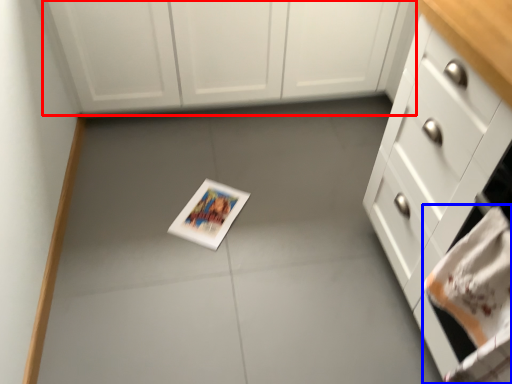
Question: Which object appears farthest to the camera in this image, cabinetry (highlighted by a red box) or hand towel (highlighted by a blue box)?

Choices:
 (A) cabinetry
 (B) hand towel

Answer: (A)